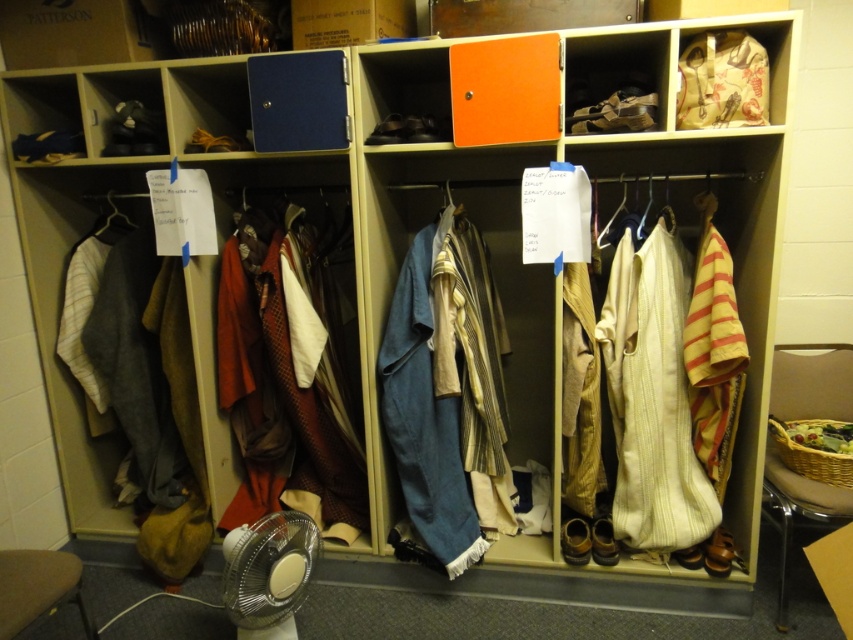
You are organizing the storage area and need to access the white plastic fan at lower left. Is it possible to reach it without moving the textured wool coat at center?

The white plastic fan at lower left is behind the textured wool coat at center, so you would need to move the coat to access the fan.

You are standing in front of the storage area and want to reach two points marked in the image. Which point, point (218, 300) or point (268, 536), is closer to you?

Point (218, 300) is closer to you because it is further to the viewer than point (268, 536).

What are the coordinates of the blue linen coat at center?

The blue linen coat at center is located at coordinates point (425, 417).